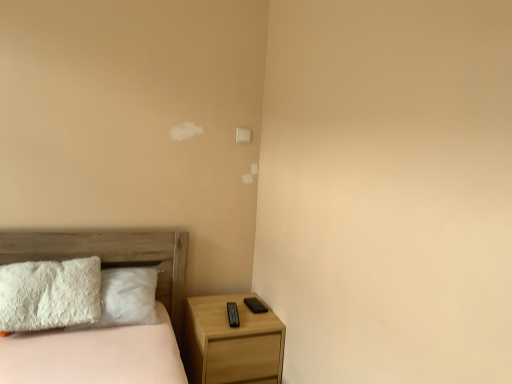
Image resolution: width=512 pixels, height=384 pixels. What are the coordinates of `wooden bed at lower left` in the screenshot? It's located at (102, 329).

Describe the element at coordinates (102, 329) in the screenshot. The height and width of the screenshot is (384, 512). I see `wooden bed at lower left` at that location.

You are a GUI agent. You are given a task and a screenshot of the screen. Output one action in this format:
    pyautogui.click(x=<x>, y=<y>)
    Task: Click on the light wood/texture nightstand at lower right
    This screenshot has width=512, height=384.
    Given the screenshot: What is the action you would take?
    pyautogui.click(x=231, y=342)

What is the approximate height of light wood/texture nightstand at lower right?

light wood/texture nightstand at lower right is 22.18 inches tall.

What do you see at coordinates (231, 342) in the screenshot? Image resolution: width=512 pixels, height=384 pixels. I see `light wood/texture nightstand at lower right` at bounding box center [231, 342].

In order to click on wooden bed at lower left in this screenshot , I will do `click(102, 329)`.

Can you confirm if light wood/texture nightstand at lower right is positioned to the left of wooden bed at lower left?

No.

In the scene shown: Which object is further away from the camera taking this photo, light wood/texture nightstand at lower right or wooden bed at lower left?

Positioned behind is light wood/texture nightstand at lower right.

Which is in front, point (217, 369) or point (115, 244)?

The point (217, 369) is more forward.

From the image's perspective, which object appears higher, light wood/texture nightstand at lower right or wooden bed at lower left?

wooden bed at lower left appears higher in the image.

From a real-world perspective, which is physically above, light wood/texture nightstand at lower right or wooden bed at lower left?

wooden bed at lower left, from a real-world perspective.

Based on the photo, which object is wider, light wood/texture nightstand at lower right or wooden bed at lower left?

wooden bed at lower left is wider.

Between light wood/texture nightstand at lower right and wooden bed at lower left, which one has more height?

With more height is wooden bed at lower left.

Considering the relative sizes of light wood/texture nightstand at lower right and wooden bed at lower left in the image provided, is light wood/texture nightstand at lower right bigger than wooden bed at lower left?

Actually, light wood/texture nightstand at lower right might be smaller than wooden bed at lower left.

Does light wood/texture nightstand at lower right contain wooden bed at lower left?

Definitely not — wooden bed at lower left is not inside light wood/texture nightstand at lower right.

From the picture: Is light wood/texture nightstand at lower right far away from wooden bed at lower left?

They are positioned close to each other.

Is light wood/texture nightstand at lower right positioned with its back to wooden bed at lower left?

No, light wood/texture nightstand at lower right's orientation is not away from wooden bed at lower left.

How much distance is there between light wood/texture nightstand at lower right and wooden bed at lower left?

light wood/texture nightstand at lower right and wooden bed at lower left are 14.67 inches apart from each other.

In order to click on nightstand behind the wooden bed at lower left in this screenshot , I will do `click(231, 342)`.

Considering the positions of objects wooden bed at lower left and light wood/texture nightstand at lower right in the image provided, who is more to the right, wooden bed at lower left or light wood/texture nightstand at lower right?

light wood/texture nightstand at lower right is more to the right.

Does wooden bed at lower left lie behind light wood/texture nightstand at lower right?

No, it is not.

Does point (79, 231) lie behind point (183, 345)?

No, it is not.

From the image's perspective, is wooden bed at lower left above or below light wood/texture nightstand at lower right?

wooden bed at lower left is situated higher than light wood/texture nightstand at lower right in the image.

From a real-world perspective, is wooden bed at lower left above or below light wood/texture nightstand at lower right?

From a real-world perspective, wooden bed at lower left is physically above light wood/texture nightstand at lower right.

In terms of width, does wooden bed at lower left look wider or thinner when compared to light wood/texture nightstand at lower right?

wooden bed at lower left is wider than light wood/texture nightstand at lower right.

Does wooden bed at lower left have a lesser height compared to light wood/texture nightstand at lower right?

No, wooden bed at lower left is not shorter than light wood/texture nightstand at lower right.

Is wooden bed at lower left bigger than light wood/texture nightstand at lower right?

Yes.

Is light wood/texture nightstand at lower right completely or partially inside wooden bed at lower left?

No, light wood/texture nightstand at lower right is not a part of wooden bed at lower left.

Is wooden bed at lower left positioned far away from light wood/texture nightstand at lower right?

Actually, wooden bed at lower left and light wood/texture nightstand at lower right are a little close together.

Could you tell me if wooden bed at lower left is turned towards light wood/texture nightstand at lower right?

No, wooden bed at lower left is not aimed at light wood/texture nightstand at lower right.

Can you tell me how much wooden bed at lower left and light wood/texture nightstand at lower right differ in facing direction?

There is a 0.942-degree angle between the facing directions of wooden bed at lower left and light wood/texture nightstand at lower right.

How far apart are wooden bed at lower left and light wood/texture nightstand at lower right?

wooden bed at lower left and light wood/texture nightstand at lower right are 14.67 inches apart.

Find the location of a particular element. This screenshot has width=512, height=384. nightstand that appears on the right of wooden bed at lower left is located at coordinates (231, 342).

The height and width of the screenshot is (384, 512). Identify the location of bed in front of the light wood/texture nightstand at lower right. (102, 329).

In the image, there is a wooden bed at lower left. Identify the location of nightstand below it (from a real-world perspective). (231, 342).